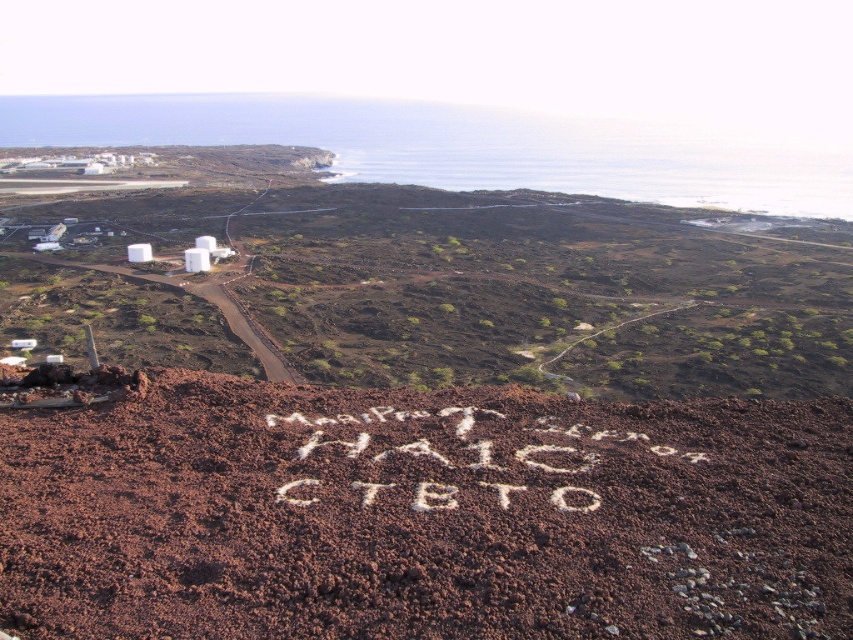
Question: Which of the following is the farthest from the observer?

Choices:
 (A) brown dirt at center
 (B) white sand at center

Answer: (B)

Question: Is brown dirt at center further to the viewer compared to white sand at center?

Choices:
 (A) no
 (B) yes

Answer: (A)

Question: Does brown dirt at center appear on the right side of white sand at center?

Choices:
 (A) yes
 (B) no

Answer: (B)

Question: Can you confirm if brown dirt at center is smaller than white sand at center?

Choices:
 (A) yes
 (B) no

Answer: (B)